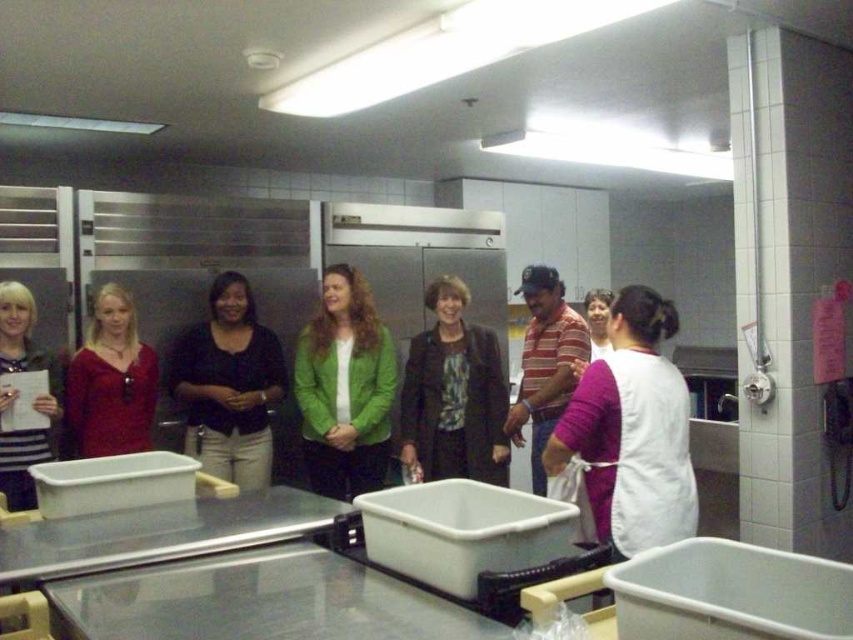
You are a delivery person who needs to place a 1.2 meter long package between the green matte blazer at center and the matte black shirt at left. Is there enough space between them to fit the package?

The distance between the green matte blazer at center and the matte black shirt at left is 1.15 meters, which is shorter than the 1.2 meter long package. Therefore, the package cannot fit between them.

You are a food service worker in the commercial kitchen. You need to hand a tool to both the person wearing the matte black shirt at center and the person wearing the matte red sweater at center. Which person should you approach first to ensure you can reach them without moving around the table?

You should approach the matte black shirt at center first because they are closer to you than the matte red sweater at center, so you can reach them without needing to move around the table.

You are a chef in this commercial kitchen and need to choose a uniform for a new employee. The requirement is that the uniform must be the same size as the existing staff. Looking at the people wearing the matte black shirt at center and the matte red sweater at center, which one should the new employee wear to match the size of the existing staff?

The new employee should wear the matte black shirt at center because it has a larger size compared to the matte red sweater at center, ensuring consistency with the existing staff size.